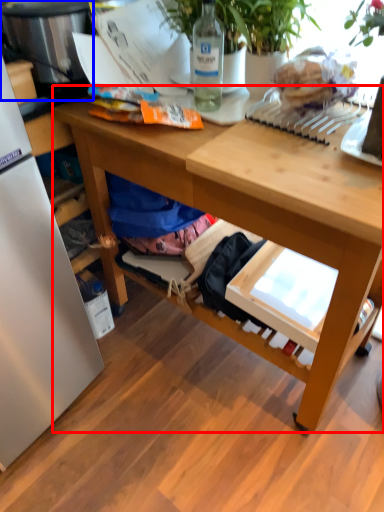
Question: Which of the following is the farthest to the observer, desk (highlighted by a red box) or appliance (highlighted by a blue box)?

Choices:
 (A) desk
 (B) appliance

Answer: (B)